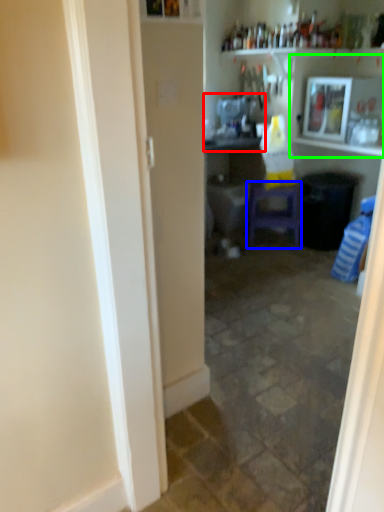
Question: Which object is positioned closest to sink (highlighted by a red box)? Select from furniture (highlighted by a blue box) and shelf (highlighted by a green box).

Choices:
 (A) furniture
 (B) shelf

Answer: (B)